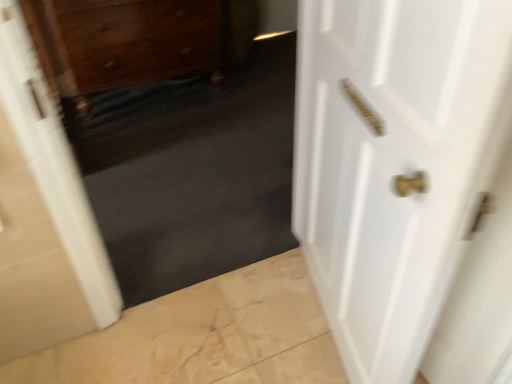
The width and height of the screenshot is (512, 384). I want to click on vacant area that lies between wooden drawer at upper left and dark matte carpet at center, so click(187, 165).